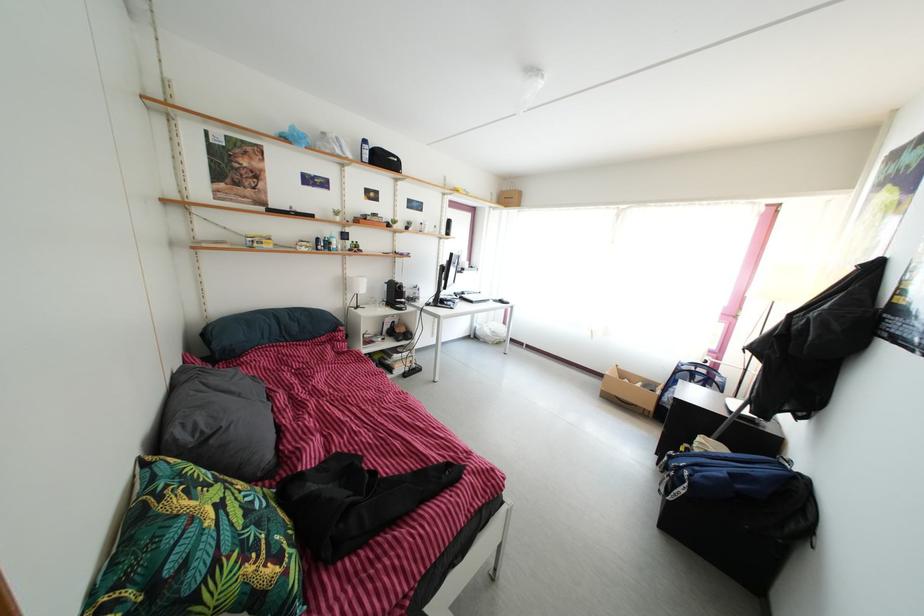
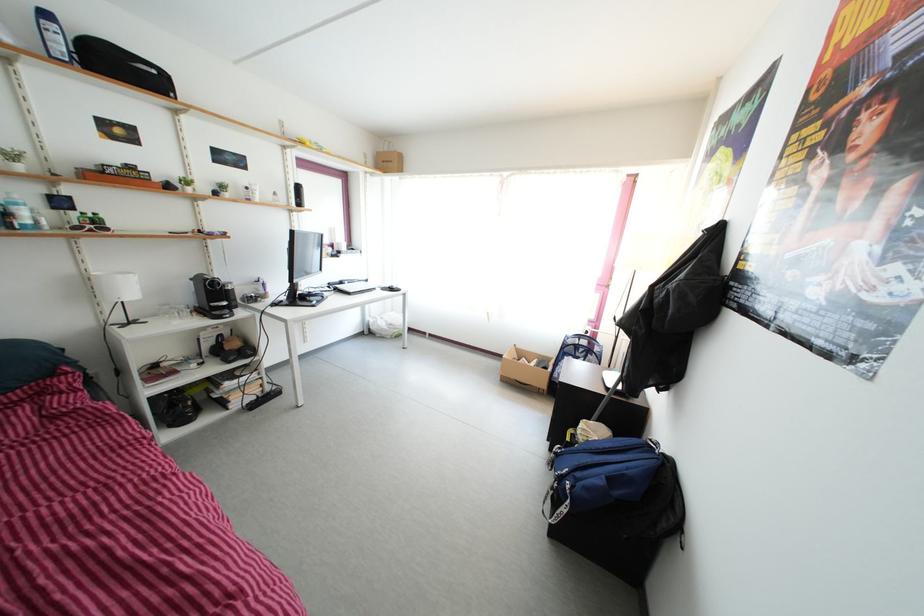
Question: The camera is either moving clockwise (left) or counter-clockwise (right) around the object. The first image is from the beginning of the video and the second image is from the end. Is the camera moving left or right when shooting the video?

Choices:
 (A) Left
 (B) Right

Answer: (A)